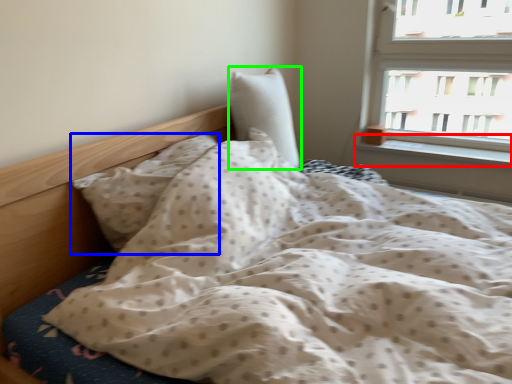
Question: Which object is the farthest from window sill (highlighted by a red box)? Choose among these: pillow (highlighted by a blue box) or pillow (highlighted by a green box).

Choices:
 (A) pillow
 (B) pillow

Answer: (A)